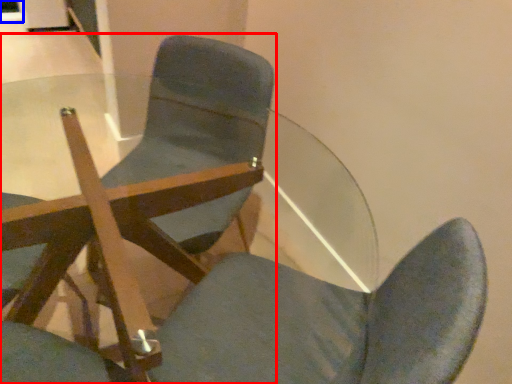
Question: Which point is closer to the camera, chair (highlighted by a red box) or glass door (highlighted by a blue box)?

Choices:
 (A) chair
 (B) glass door

Answer: (A)